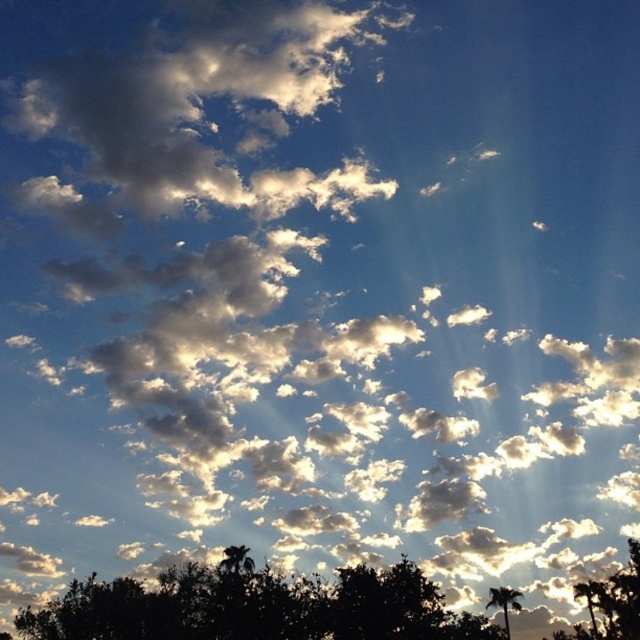
Question: Is silhouette leafy tree at lower center above green leafy tree at lower right?

Choices:
 (A) no
 (B) yes

Answer: (B)

Question: Considering the relative positions of silhouette leafy tree at lower center and green leafy tree at lower right in the image provided, where is silhouette leafy tree at lower center located with respect to green leafy tree at lower right?

Choices:
 (A) right
 (B) left

Answer: (B)

Question: Which of the following is the closest to the observer?

Choices:
 (A) silhouette leafy tree at lower center
 (B) green leafy tree at lower right

Answer: (A)

Question: Which of the following is the farthest from the observer?

Choices:
 (A) (332, 624)
 (B) (499, 593)

Answer: (B)

Question: Observing the image, what is the correct spatial positioning of silhouette leafy tree at lower center in reference to green leafy tree at lower right?

Choices:
 (A) above
 (B) below

Answer: (A)